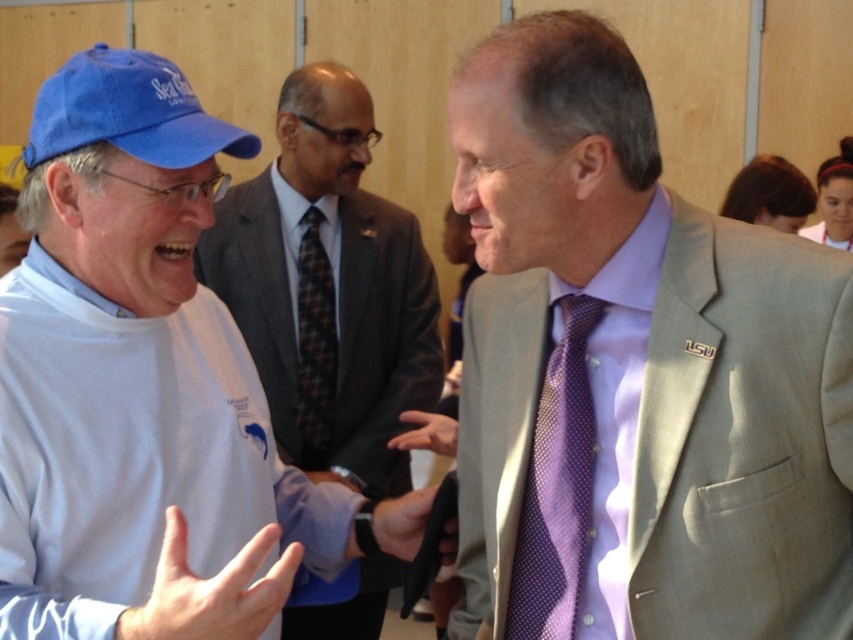
You are standing at the point marked by the coordinates point (x=520, y=150). You want to greet the man on the right who is wearing a light gray suit jacket with an LSU pin on the lapel. Can you reach him without moving from your current position?

The distance between you and the man on the right who is wearing a light gray suit jacket with an LSU pin on the lapel is 1.44 meters. Since you are not moving from your current position at point (x=520, y=150), you can greet him as you are within a reasonable conversational distance.

You are standing in front of the two men in the image. Which of the two points, point (622, 88) or point (527, 573), is closer to you?

Point (622, 88) is closer to the viewer than point (527, 573).